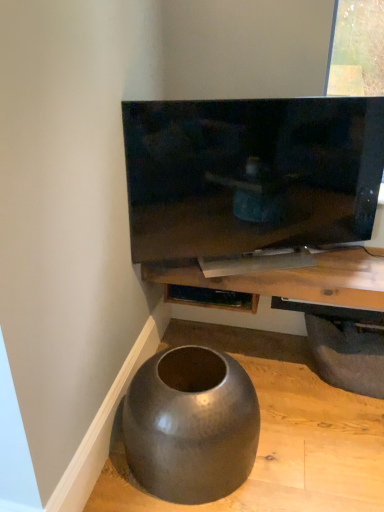
Where is `free spot below matte black tv at upper center (from a real-world perspective)`? free spot below matte black tv at upper center (from a real-world perspective) is located at coordinates (276, 263).